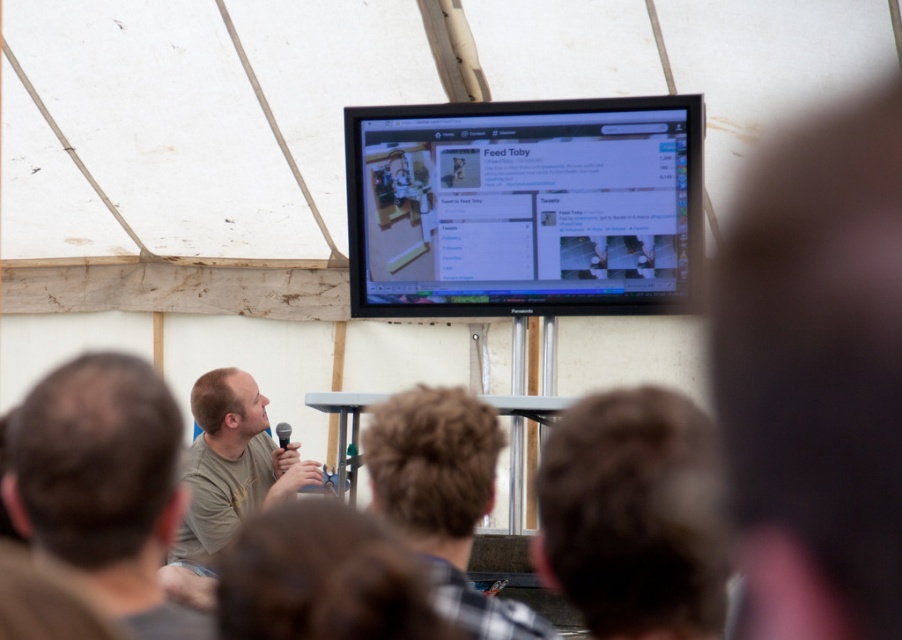
Question: Does matte black monitor at upper center appear over matte khaki shirt at lower left?

Choices:
 (A) no
 (B) yes

Answer: (B)

Question: Which point appears closest to the camera in this image?

Choices:
 (A) (149, 442)
 (B) (286, 442)
 (C) (250, 428)

Answer: (A)

Question: Based on their relative distances, which object is nearer to the light brown hair at left?

Choices:
 (A) black plastic microphone at upper center
 (B) brown hair at center

Answer: (B)

Question: Is matte black monitor at upper center further to camera compared to matte khaki shirt at lower left?

Choices:
 (A) yes
 (B) no

Answer: (A)

Question: Which point is farther to the camera?

Choices:
 (A) brown hair at center
 (B) matte khaki shirt at lower left
 (C) light brown hair at left
 (D) black plastic microphone at upper center

Answer: (D)

Question: Is light brown hair at left to the right of matte khaki shirt at lower left from the viewer's perspective?

Choices:
 (A) yes
 (B) no

Answer: (A)